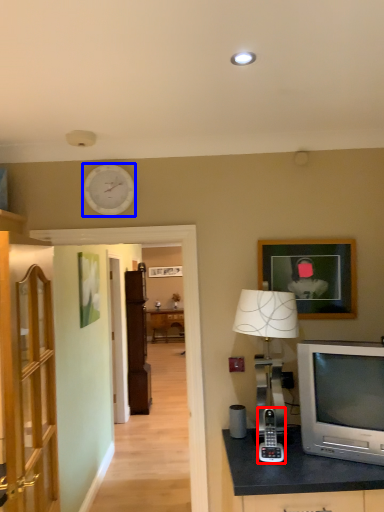
Question: Which point is further to the camera, gadget (highlighted by a red box) or clock (highlighted by a blue box)?

Choices:
 (A) gadget
 (B) clock

Answer: (B)